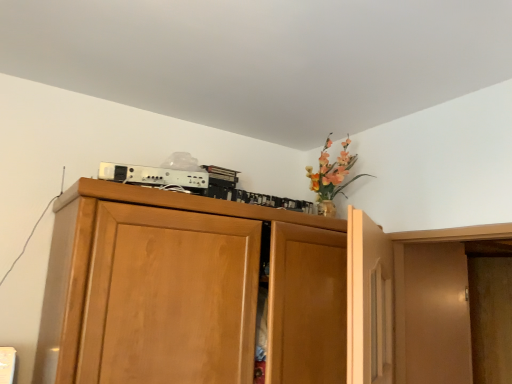
Measure the distance between wooden cabinet at center and camera.

wooden cabinet at center is 3.71 feet away from camera.

Where is `wooden cabinet at center`? This screenshot has height=384, width=512. wooden cabinet at center is located at coordinates (247, 293).

This screenshot has height=384, width=512. What do you see at coordinates (247, 293) in the screenshot? I see `wooden cabinet at center` at bounding box center [247, 293].

What is the approximate width of wooden cabinet at center?

wooden cabinet at center is 27.09 inches in width.

You are a GUI agent. You are given a task and a screenshot of the screen. Output one action in this format:
    pyautogui.click(x=<x>, y=<y>)
    Task: Click on the wooden cabinet at center
    
    Given the screenshot: What is the action you would take?
    pyautogui.click(x=247, y=293)